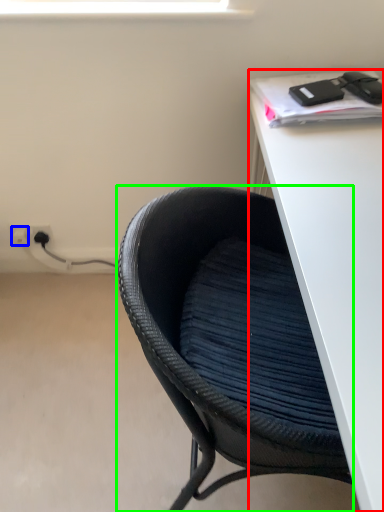
Question: Considering the real-world distances, which object is closest to desk (highlighted by a red box)? electric outlet (highlighted by a blue box) or chair (highlighted by a green box).

Choices:
 (A) electric outlet
 (B) chair

Answer: (B)